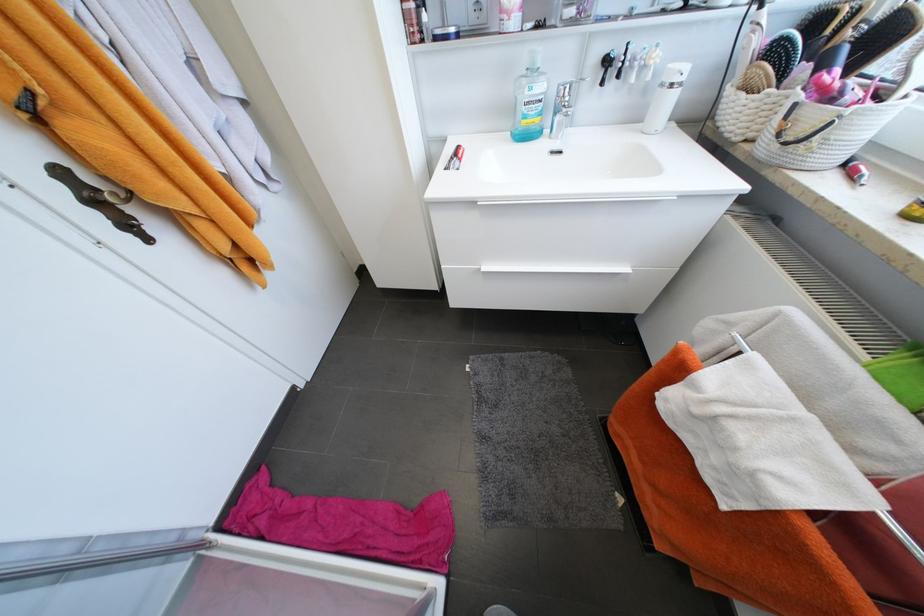
Where would you lift the blue mouthwash bottle? Please return your answer as a coordinate pair (x, y).

(529, 100)